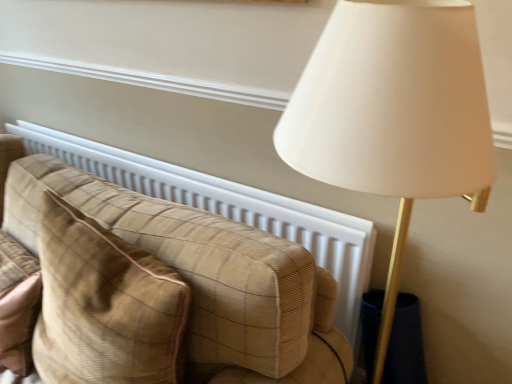
Question: Can you confirm if plaid fabric pillow at left is wider than plaid fabric couch at center?

Choices:
 (A) no
 (B) yes

Answer: (B)

Question: Can you confirm if plaid fabric pillow at left is positioned to the left of plaid fabric couch at center?

Choices:
 (A) no
 (B) yes

Answer: (A)

Question: From the image's perspective, would you say plaid fabric pillow at left is shown under plaid fabric couch at center?

Choices:
 (A) no
 (B) yes

Answer: (B)

Question: Can plaid fabric couch at center be found inside plaid fabric pillow at left?

Choices:
 (A) yes
 (B) no

Answer: (B)

Question: Is plaid fabric pillow at left not close to plaid fabric couch at center?

Choices:
 (A) no
 (B) yes

Answer: (A)

Question: Is plaid fabric pillow at left not inside plaid fabric couch at center?

Choices:
 (A) no
 (B) yes

Answer: (B)

Question: Is plaid fabric pillow at left completely or partially inside plaid fabric couch at center?

Choices:
 (A) yes
 (B) no

Answer: (B)

Question: Is plaid fabric couch at center at the right side of plaid fabric pillow at left?

Choices:
 (A) yes
 (B) no

Answer: (B)

Question: Can you confirm if plaid fabric couch at center is bigger than plaid fabric pillow at left?

Choices:
 (A) no
 (B) yes

Answer: (B)

Question: Does plaid fabric couch at center have a greater width compared to plaid fabric pillow at left?

Choices:
 (A) no
 (B) yes

Answer: (A)

Question: Does plaid fabric couch at center turn towards plaid fabric pillow at left?

Choices:
 (A) yes
 (B) no

Answer: (A)

Question: Is plaid fabric couch at center taller than plaid fabric pillow at left?

Choices:
 (A) yes
 (B) no

Answer: (A)

Question: In the image, is plaid fabric pillow at left on the left side or the right side of plaid fabric couch at center?

Choices:
 (A) left
 (B) right

Answer: (B)